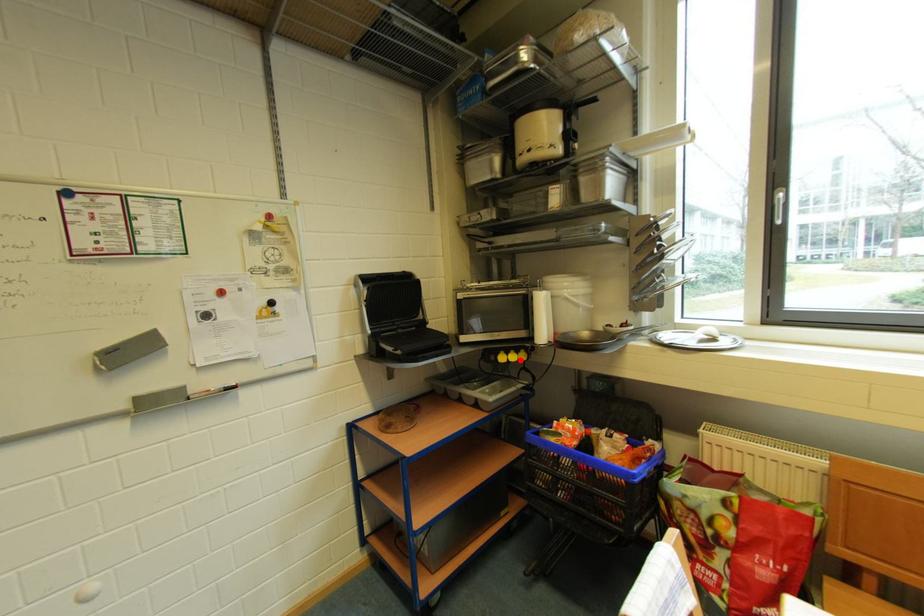
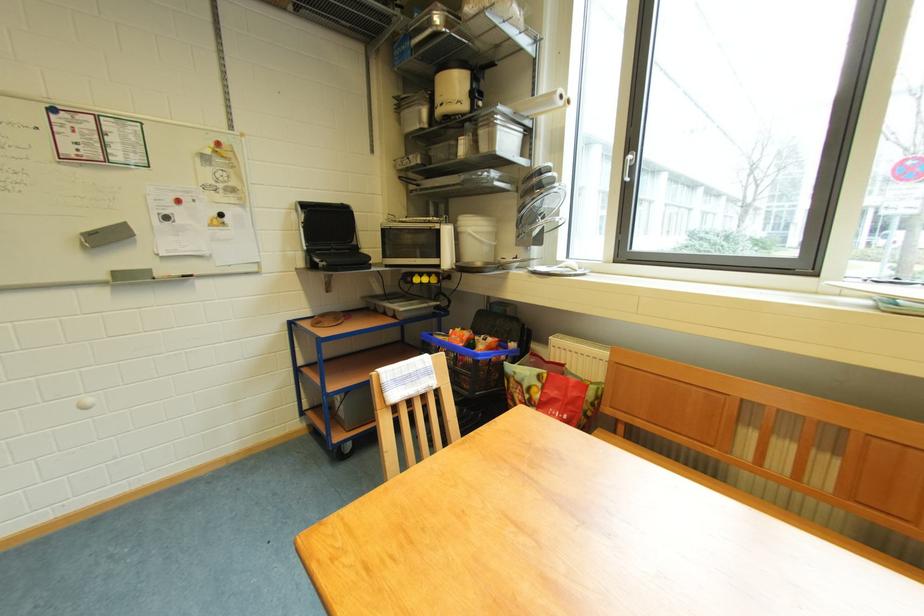
Find the pixel in the second image that matches the highlighted location in the first image.

(432, 283)